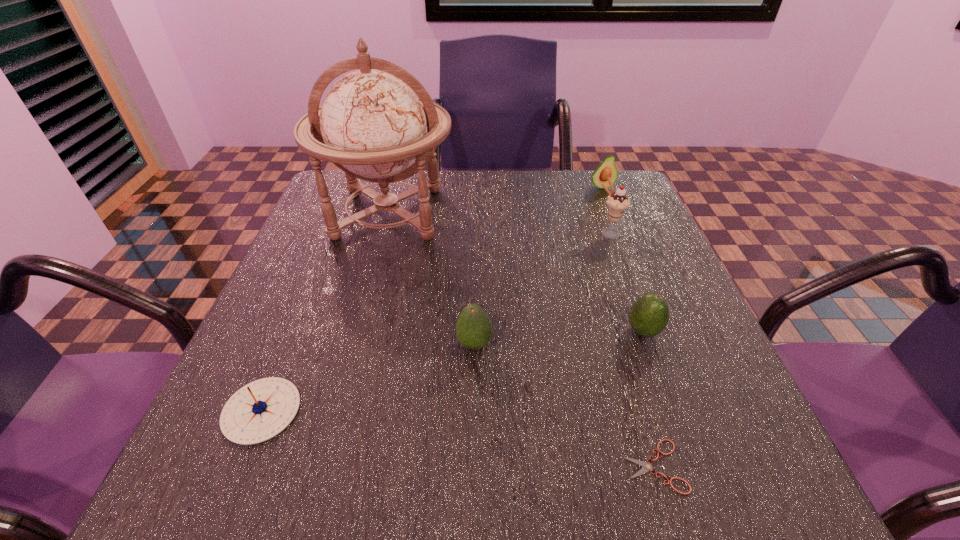
At what (x,y) coordinates should I click in order to perform the action: click on vacant space at the far right corner of the desktop. Please return your answer as a coordinate pair (x, y). The image size is (960, 540). Looking at the image, I should click on (588, 176).

Identify the location of vacant area between the third object from left to right and the farthest avocado. This screenshot has height=540, width=960. (538, 266).

Locate an element on the screen. free point between the sixth tallest object and the leftmost avocado is located at coordinates (368, 377).

The width and height of the screenshot is (960, 540). Identify the location of vacant space in between the sixth shortest object and the leftmost avocado. (541, 289).

Where is `free space that is in between the sixth shortest object and the globe`? This screenshot has height=540, width=960. free space that is in between the sixth shortest object and the globe is located at coordinates (498, 224).

Find the location of a particular element. Image resolution: width=960 pixels, height=540 pixels. vacant region between the farthest avocado and the third object from left to right is located at coordinates (538, 266).

Find the location of a particular element. The image size is (960, 540). vacant space that's between the shortest object and the farthest avocado is located at coordinates (628, 326).

This screenshot has height=540, width=960. In order to click on empty space between the icecream and the compass in this screenshot , I will do `click(435, 322)`.

In order to click on blank region between the shears and the fifth object from right to left in this screenshot , I will do `click(564, 405)`.

At what (x,y) coordinates should I click in order to perform the action: click on free space between the icecream and the fifth object from right to left. Please return your answer as a coordinate pair (x, y). The height and width of the screenshot is (540, 960). Looking at the image, I should click on [x=541, y=289].